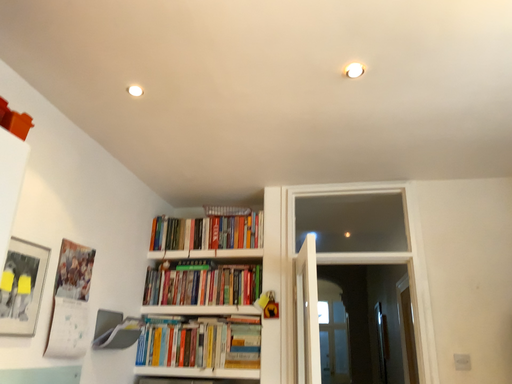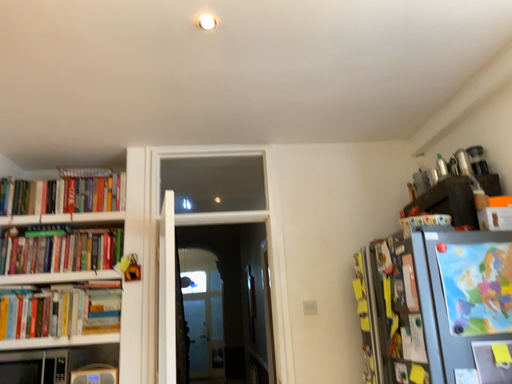
Question: Which way did the camera rotate in the video?

Choices:
 (A) rotated left
 (B) rotated right

Answer: (B)